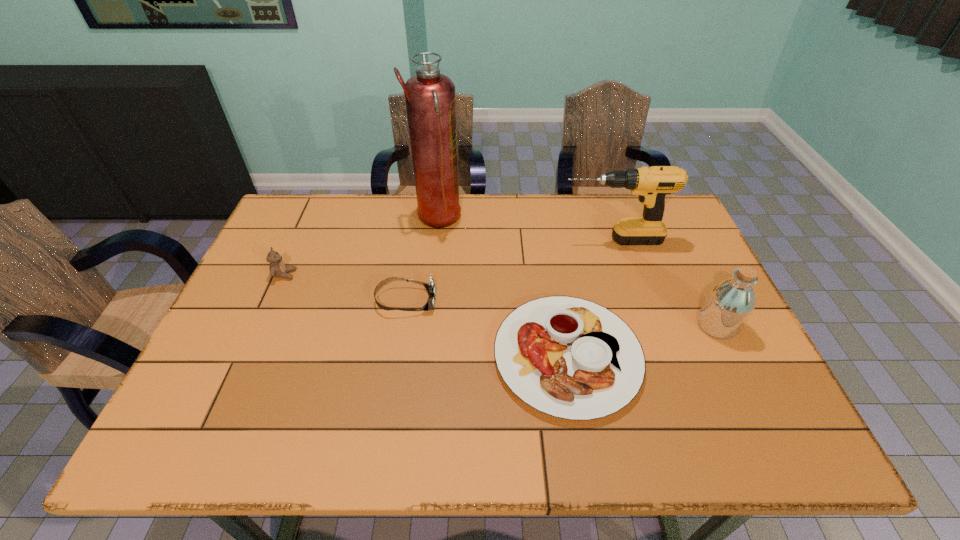
The image size is (960, 540). Identify the location of fire extinguisher. (430, 101).

Where is `drill`? The width and height of the screenshot is (960, 540). drill is located at coordinates (652, 184).

Locate an element on the screen. bottle is located at coordinates (729, 304).

Locate an element on the screen. teddy bear is located at coordinates (277, 268).

The image size is (960, 540). In order to click on the third shortest object in this screenshot , I will do `click(277, 268)`.

Where is `goggles`? goggles is located at coordinates (430, 287).

Locate an element on the screen. the shortest object is located at coordinates (571, 358).

The width and height of the screenshot is (960, 540). Find the location of `vacant region located on the side of the fire extinguisher with the label`. vacant region located on the side of the fire extinguisher with the label is located at coordinates (494, 219).

The image size is (960, 540). What are the coordinates of `blank space located at the tip of the drill` in the screenshot? It's located at (484, 240).

The height and width of the screenshot is (540, 960). Find the location of `free space located 0.160m at the tip of the drill`. free space located 0.160m at the tip of the drill is located at coordinates (507, 240).